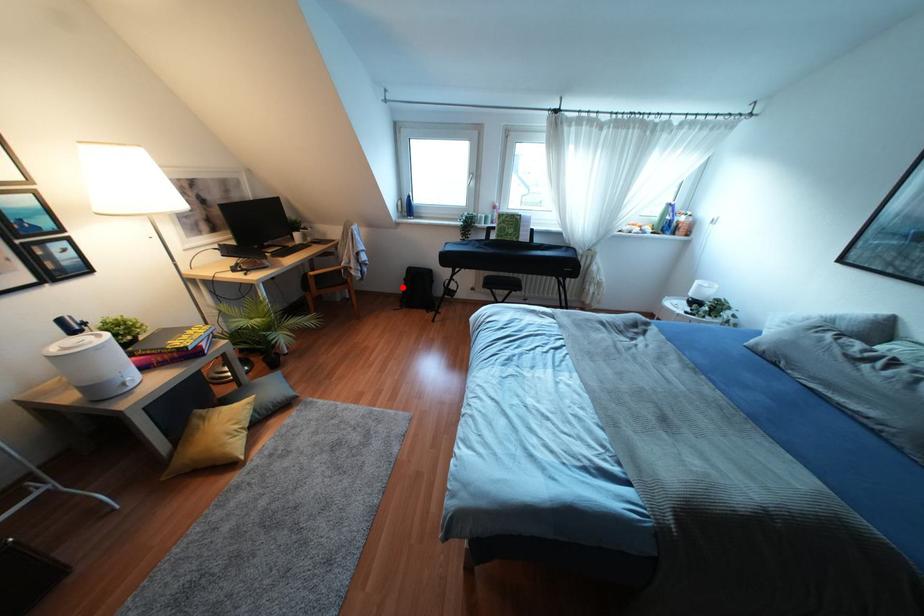
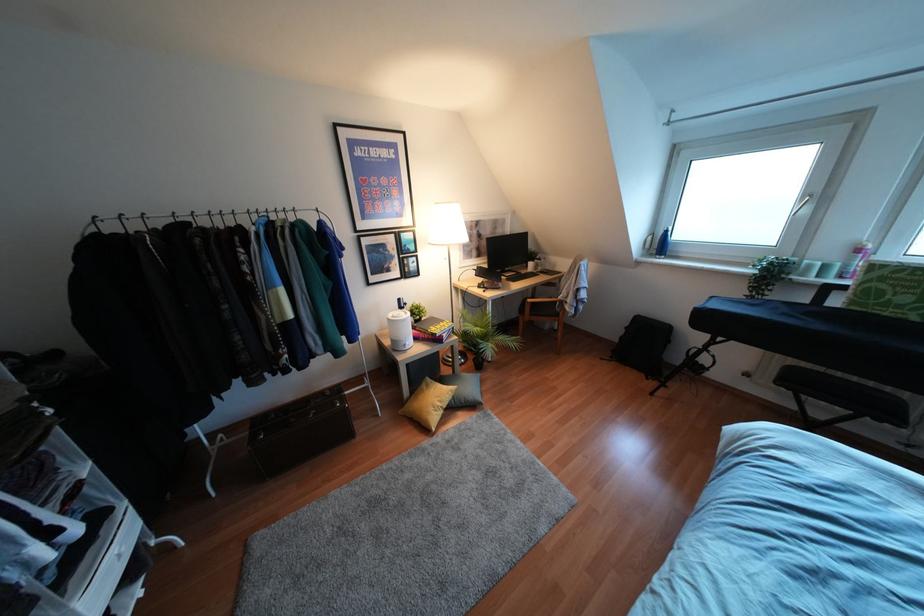
In the second image, find the point that corresponds to the highlighted location in the first image.

(621, 337)